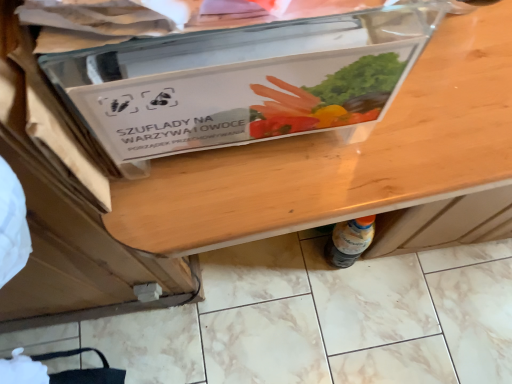
This screenshot has width=512, height=384. Identify the location of transparent plastic lunch box at center. (241, 82).

What do you see at coordinates (241, 82) in the screenshot? Image resolution: width=512 pixels, height=384 pixels. I see `transparent plastic lunch box at center` at bounding box center [241, 82].

Where is `transparent plastic lunch box at center`? This screenshot has height=384, width=512. transparent plastic lunch box at center is located at coordinates (241, 82).